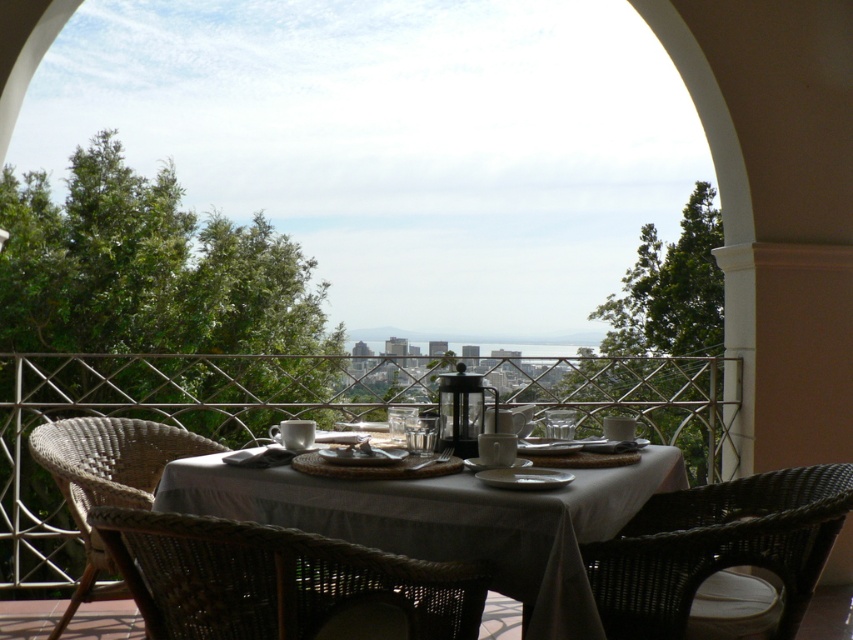
Consider the image. Is woven rattan chair at lower center above woven rattan chair at lower left?

Yes.

From the picture: Can you confirm if woven rattan chair at lower center is thinner than woven rattan chair at lower left?

Incorrect, woven rattan chair at lower center's width is not less than woven rattan chair at lower left's.

What are the coordinates of `woven rattan chair at lower center` in the screenshot? It's located at (281, 582).

Where is `woven rattan chair at lower center`? woven rattan chair at lower center is located at coordinates (281, 582).

Is the position of white woven table at center more distant than that of woven dark brown chair at lower right?

No, it is in front of woven dark brown chair at lower right.

Find the location of a particular element. white woven table at center is located at coordinates (447, 520).

The height and width of the screenshot is (640, 853). What do you see at coordinates (447, 520) in the screenshot?
I see `white woven table at center` at bounding box center [447, 520].

The height and width of the screenshot is (640, 853). I want to click on white woven table at center, so point(447,520).

Does woven dark brown chair at lower right have a lesser height compared to white ceramic plate at center?

In fact, woven dark brown chair at lower right may be taller than white ceramic plate at center.

Who is positioned more to the left, woven dark brown chair at lower right or white ceramic plate at center?

white ceramic plate at center is more to the left.

Measure the distance between woven dark brown chair at lower right and camera.

They are 2.26 meters apart.

The height and width of the screenshot is (640, 853). Identify the location of woven dark brown chair at lower right. (717, 547).